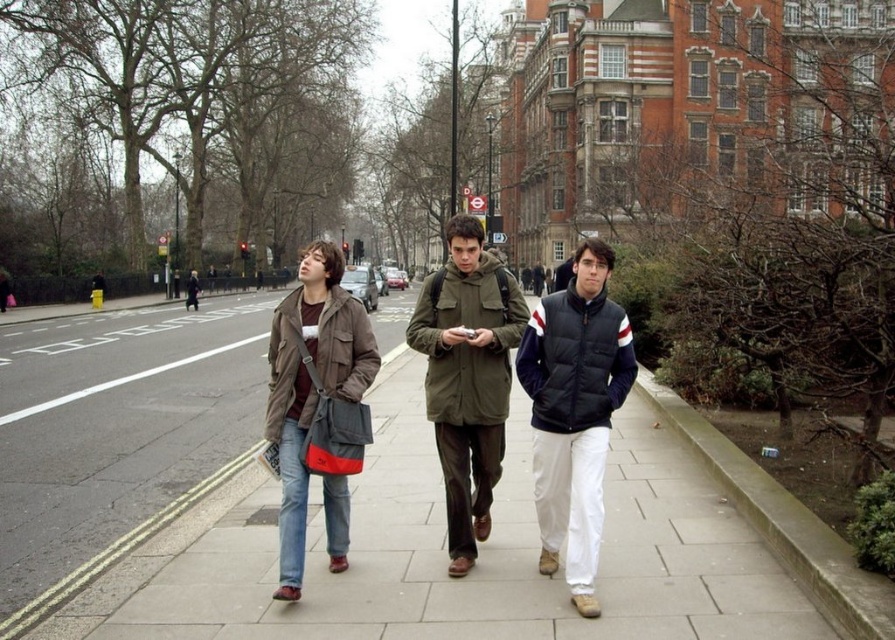
Question: Does smooth concrete pavement at center appear over brown textured jacket at center?

Choices:
 (A) yes
 (B) no

Answer: (B)

Question: Which of the following is the farthest from the observer?

Choices:
 (A) (312, 403)
 (B) (517, 371)
 (C) (466, 620)
 (D) (491, 500)

Answer: (B)

Question: Which of the following is the closest to the observer?

Choices:
 (A) (305, 276)
 (B) (598, 355)

Answer: (B)

Question: Is the position of brown leather jacket at center less distant than that of dark blue quilted jacket at center?

Choices:
 (A) yes
 (B) no

Answer: (A)

Question: Estimate the real-world distances between objects in this image. Which object is farther from the olive green parka at center?

Choices:
 (A) brown leather jacket at center
 (B) olive green canvas jacket at center
 (C) smooth concrete pavement at center

Answer: (C)

Question: In this image, where is dark blue quilted jacket at center located relative to brown textured jacket at center?

Choices:
 (A) above
 (B) below

Answer: (B)